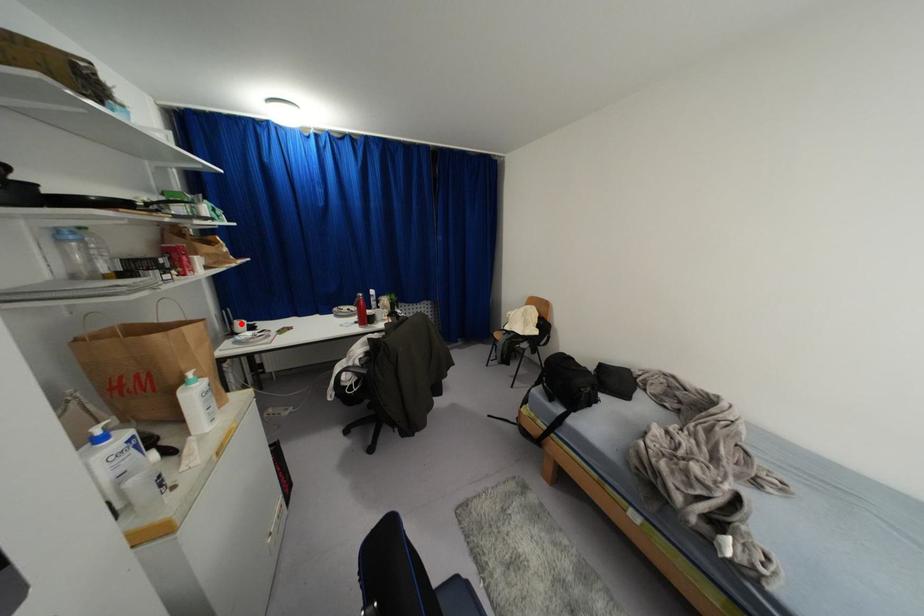
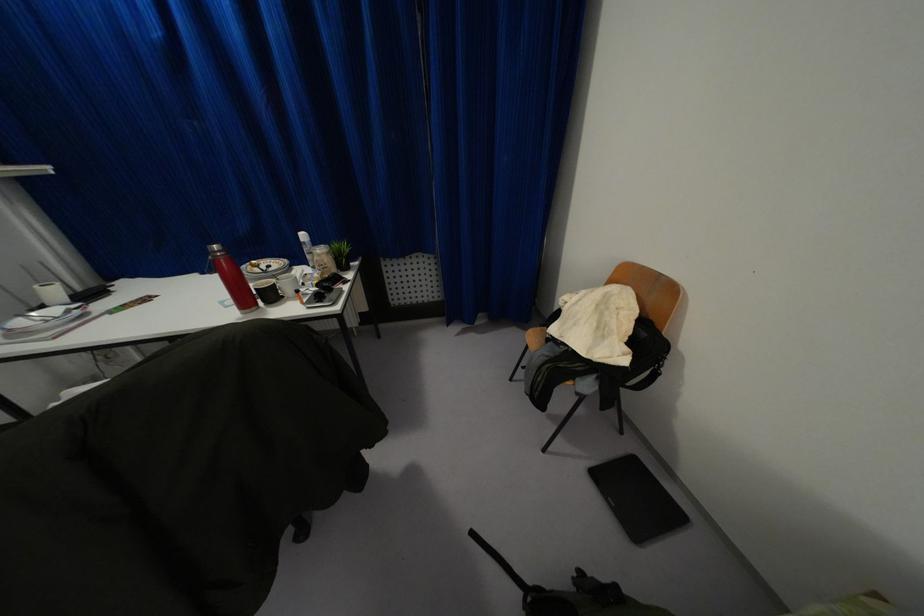
Locate, in the second image, the point that corresponds to the highlighted location in the first image.

(53, 291)